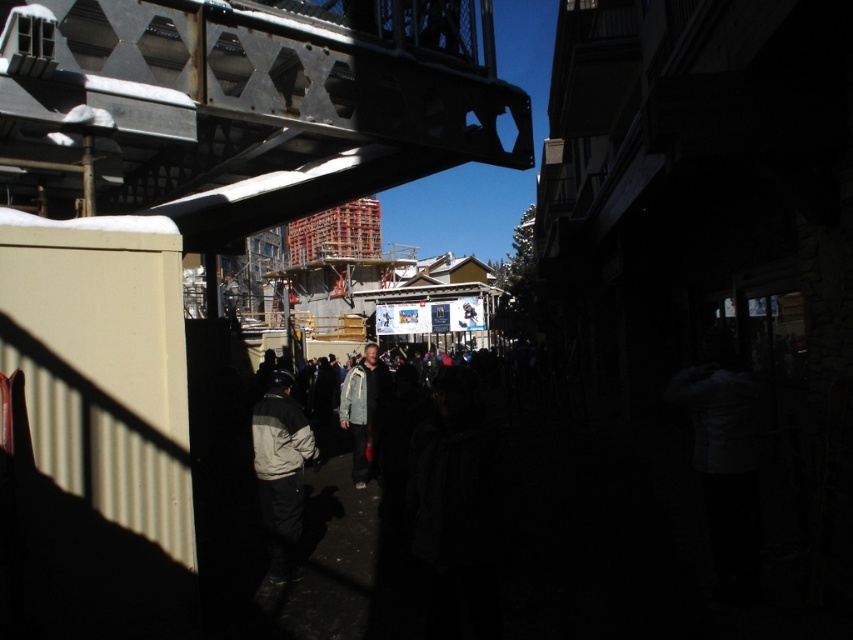
Question: Observing the image, what is the correct spatial positioning of gray fleece jacket at center in reference to light gray jacket at center?

Choices:
 (A) below
 (B) above

Answer: (B)

Question: Is gray fleece jacket at center behind light gray jacket at center?

Choices:
 (A) yes
 (B) no

Answer: (B)

Question: Which object is farther from the camera taking this photo?

Choices:
 (A) light gray jacket at center
 (B) gray fleece jacket at center

Answer: (A)

Question: Does gray fleece jacket at center have a lesser width compared to light gray jacket at center?

Choices:
 (A) no
 (B) yes

Answer: (B)

Question: Which point is farther to the camera?

Choices:
 (A) light gray jacket at center
 (B) gray fleece jacket at center

Answer: (A)